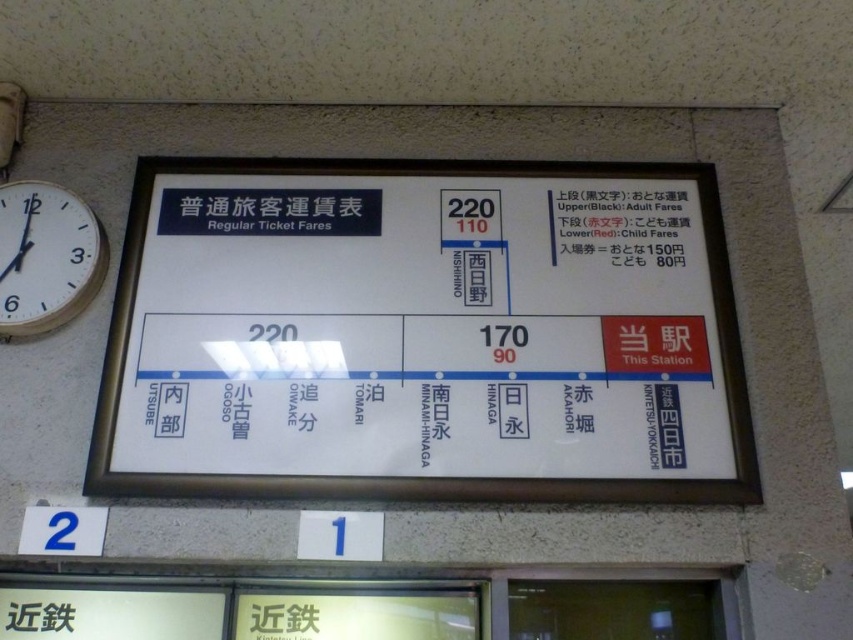
Which is in front, point (30, 180) or point (576, 205)?

Point (30, 180) is more forward.

Is wooden clock face at left in front of black text at upper center?

That is True.

I want to click on wooden clock face at left, so click(45, 257).

Is white plastic signboard at upper center above wooden clock face at left?

No.

Is white plastic signboard at upper center to the left of wooden clock face at left from the viewer's perspective?

Incorrect, white plastic signboard at upper center is not on the left side of wooden clock face at left.

Who is more forward, (x=273, y=385) or (x=57, y=252)?

Positioned in front is point (x=273, y=385).

The width and height of the screenshot is (853, 640). I want to click on white plastic signboard at upper center, so click(415, 339).

Based on the photo, does white plastic signboard at upper center appear over black text at upper center?

No.

Does white plastic signboard at upper center have a lesser width compared to black text at upper center?

Incorrect, white plastic signboard at upper center's width is not less than black text at upper center's.

Who is more distant from viewer, (160, 426) or (653, 224)?

The point (653, 224) is more distant.

Identify the location of white plastic signboard at upper center. (415, 339).